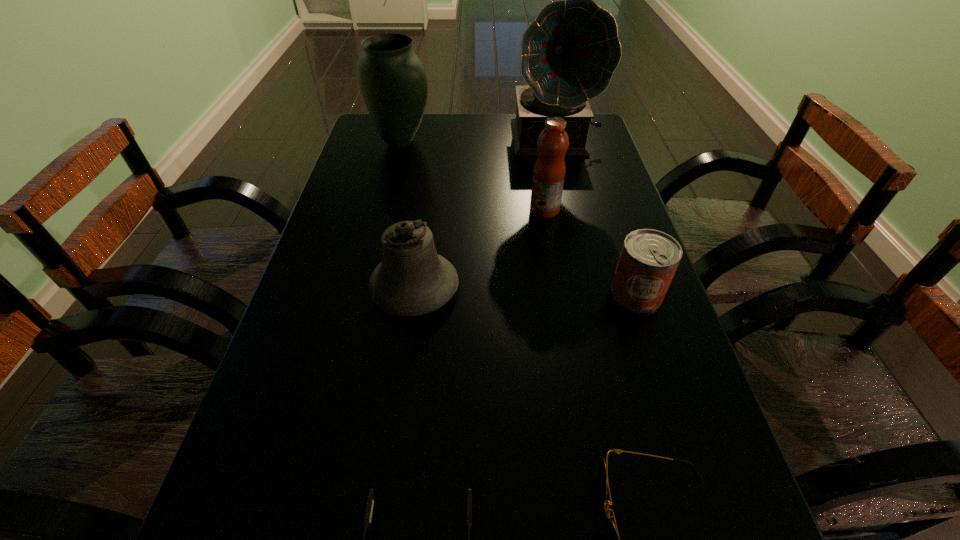
In order to click on record player in this screenshot , I will do `click(570, 51)`.

Where is `the second tallest object`? the second tallest object is located at coordinates click(x=392, y=79).

The width and height of the screenshot is (960, 540). I want to click on fruit juice, so click(549, 171).

Where is `the fifth nearest object`? This screenshot has width=960, height=540. the fifth nearest object is located at coordinates (549, 171).

Find the location of a particular element. This screenshot has width=960, height=540. the fourth tallest object is located at coordinates click(x=412, y=280).

At what (x,y) coordinates should I click in order to perform the action: click on can. Please return your answer as a coordinate pair (x, y). The image size is (960, 540). Looking at the image, I should click on coord(649,258).

I want to click on vacant region located 0.270m on the horn of the tallest object, so click(572, 221).

The width and height of the screenshot is (960, 540). I want to click on free spot located 0.070m on the back of the sixth shortest object, so click(x=406, y=120).

Where is `free spot located on the front label of the fruit juice`? Image resolution: width=960 pixels, height=540 pixels. free spot located on the front label of the fruit juice is located at coordinates (444, 210).

The height and width of the screenshot is (540, 960). In order to click on vacant position located 0.180m on the front label of the fruit juice in this screenshot , I will do `click(460, 210)`.